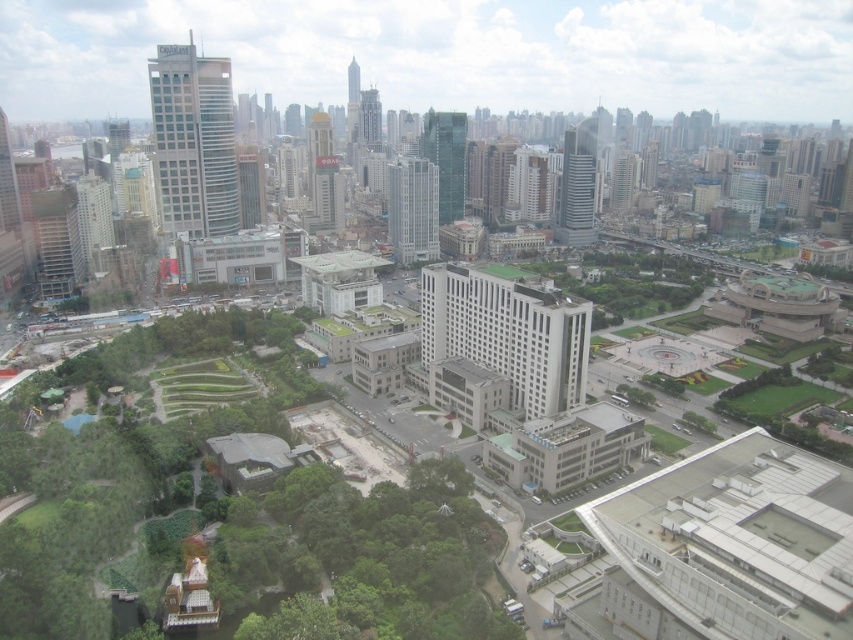
Can you confirm if green leafy tree at lower left is taller than white concrete building at center?

No, green leafy tree at lower left is not taller than white concrete building at center.

Consider the image. Which is above, green leafy tree at lower left or white concrete building at center?

white concrete building at center

Is point (363, 516) positioned in front of point (575, 360)?

Yes, point (363, 516) is closer to viewer.

Locate an element on the screen. The width and height of the screenshot is (853, 640). green leafy tree at lower left is located at coordinates click(x=376, y=554).

Does green leafy tree at lower left appear on the left side of glassy silver skyscraper at center-right?

Yes, green leafy tree at lower left is to the left of glassy silver skyscraper at center-right.

Does green leafy tree at lower left appear over glassy silver skyscraper at center-right?

No, green leafy tree at lower left is not above glassy silver skyscraper at center-right.

Where is `green leafy tree at lower left`? This screenshot has height=640, width=853. green leafy tree at lower left is located at coordinates (376, 554).

Which is below, glassy steel skyscraper at center or glassy steel skyscraper at upper center?

Positioned lower is glassy steel skyscraper at center.

Image resolution: width=853 pixels, height=640 pixels. Describe the element at coordinates (369, 116) in the screenshot. I see `glassy steel skyscraper at center` at that location.

Does point (373, 131) come behind point (357, 77)?

No, it is not.

Locate an element on the screen. The image size is (853, 640). glassy steel skyscraper at center is located at coordinates (369, 116).